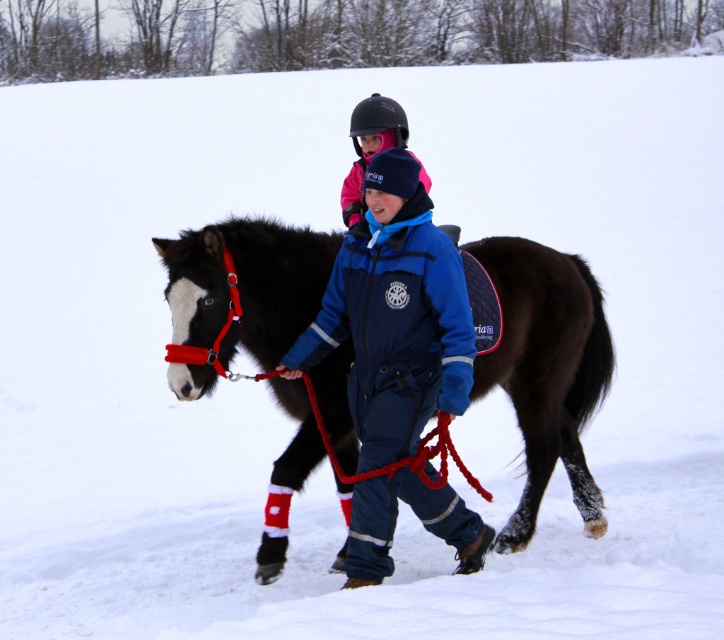
Question: Which object is closer to the camera taking this photo?

Choices:
 (A) pink matte helmet at upper center
 (B) blue fleece jacket at center
 (C) black glossy horse at center

Answer: (B)

Question: Is blue fleece jacket at center in front of pink matte helmet at upper center?

Choices:
 (A) yes
 (B) no

Answer: (A)

Question: Does black glossy horse at center appear on the left side of blue fleece jacket at center?

Choices:
 (A) no
 (B) yes

Answer: (A)

Question: Considering the real-world distances, which object is closest to the black glossy horse at center?

Choices:
 (A) blue fleece jacket at center
 (B) pink matte helmet at upper center

Answer: (A)

Question: Which object appears closest to the camera in this image?

Choices:
 (A) black glossy horse at center
 (B) blue fleece jacket at center
 (C) pink matte helmet at upper center

Answer: (B)

Question: Is black glossy horse at center to the right of pink matte helmet at upper center from the viewer's perspective?

Choices:
 (A) yes
 (B) no

Answer: (A)